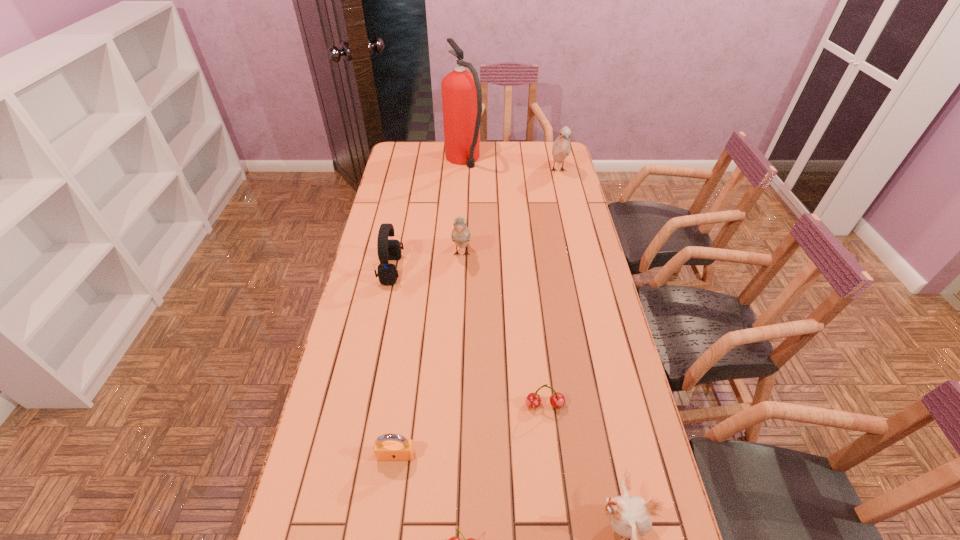
Where is `free space at the left edge`? The height and width of the screenshot is (540, 960). free space at the left edge is located at coordinates (359, 377).

Where is `vacant space at the right edge`? vacant space at the right edge is located at coordinates (579, 222).

The width and height of the screenshot is (960, 540). In the image, there is a desktop. In order to click on blank space at the far left corner in this screenshot , I will do point(411,164).

I want to click on vacant space at the far right corner of the desktop, so click(x=535, y=156).

You are a GUI agent. You are given a task and a screenshot of the screen. Output one action in this format:
    pyautogui.click(x=<x>, y=<y>)
    Task: Click on the vacant area between the tallest object and the tallest bird
    The width and height of the screenshot is (960, 540).
    Given the screenshot: What is the action you would take?
    pyautogui.click(x=511, y=166)

The width and height of the screenshot is (960, 540). Find the location of `free area in between the tallest object and the padlock`. free area in between the tallest object and the padlock is located at coordinates 429,308.

The image size is (960, 540). I want to click on empty space between the tallest object and the fifth farthest object, so click(x=504, y=283).

In order to click on free area in between the fire extinguisher and the second farthest bird in this screenshot , I will do `click(463, 208)`.

Where is `free space that is in between the tallest object and the third nearest object`? The height and width of the screenshot is (540, 960). free space that is in between the tallest object and the third nearest object is located at coordinates (429, 308).

Locate an element on the screen. The width and height of the screenshot is (960, 540). object that ranks as the closest to the tallest bird is located at coordinates (461, 91).